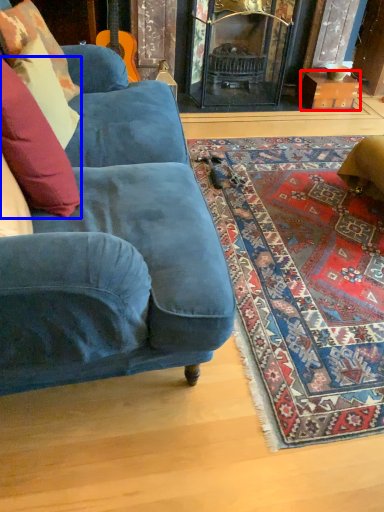
Question: Which of the following is the closest to the observer, cardboard box (highlighted by a red box) or pillow (highlighted by a blue box)?

Choices:
 (A) cardboard box
 (B) pillow

Answer: (B)